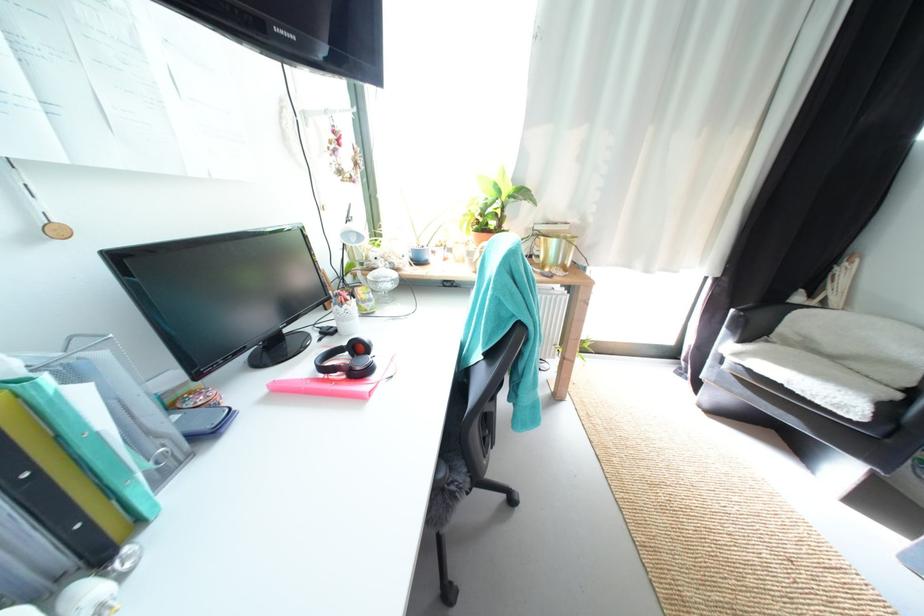
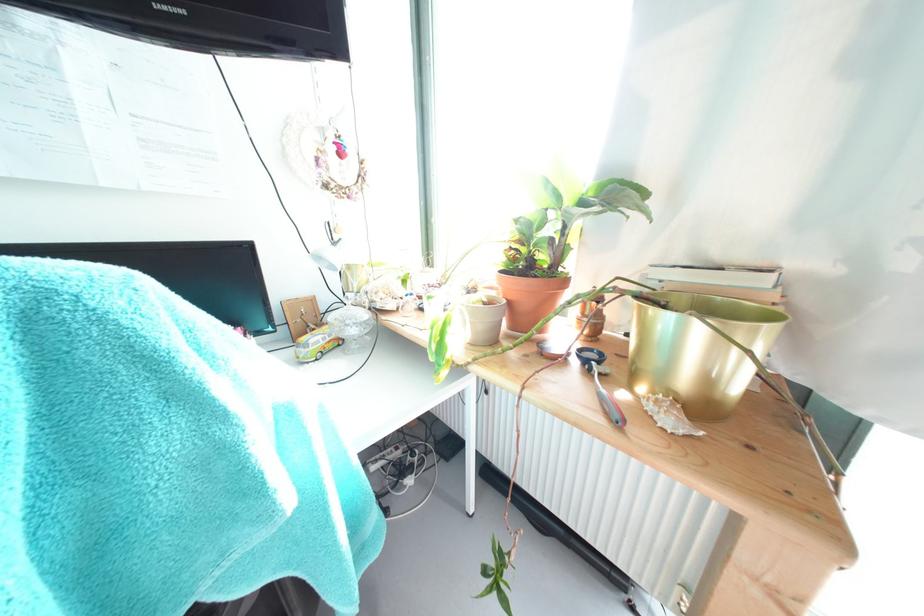
Question: The first image is from the beginning of the video and the second image is from the end. How did the camera likely rotate when shooting the video?

Choices:
 (A) Left
 (B) Right
 (C) Up
 (D) Down

Answer: (A)